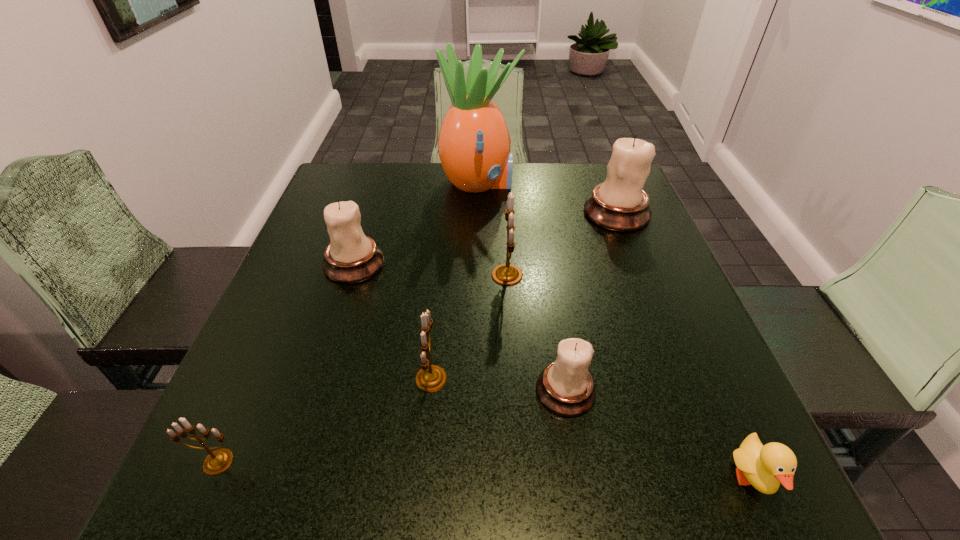
The image size is (960, 540). I want to click on pineapple, so tap(474, 144).

Where is `orange pineapple`? orange pineapple is located at coordinates (474, 144).

This screenshot has height=540, width=960. What are the coordinates of `the rightmost white candle holder` in the screenshot? It's located at (620, 204).

Identify the location of the farthest white candle holder. This screenshot has height=540, width=960. (620, 204).

You are a GUI agent. You are given a task and a screenshot of the screen. Output one action in this format:
    pyautogui.click(x=<x>, y=<y>)
    Task: Click on the fourth candelabrum from left to right
    This screenshot has width=960, height=540.
    Given the screenshot: What is the action you would take?
    pyautogui.click(x=507, y=274)

This screenshot has height=540, width=960. What are the coordinates of `the farthest gold candelabrum` in the screenshot? It's located at (507, 274).

Find the location of a particular element. This screenshot has height=540, width=960. the second candelabrum from left to right is located at coordinates [x=351, y=257].

Locate an element on the screen. This screenshot has width=960, height=540. the seventh object from right to left is located at coordinates (351, 257).

Find the location of a particular element. This screenshot has height=540, width=960. the second farthest gold candelabrum is located at coordinates (430, 378).

I want to click on the second gold candelabrum from left to right, so click(430, 378).